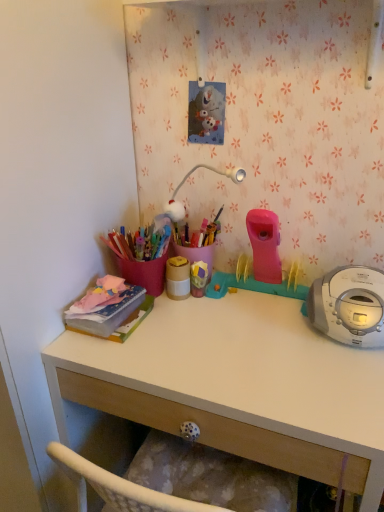
The height and width of the screenshot is (512, 384). Identify the location of free space above white matte desk at center (from a real-world perspective). (236, 336).